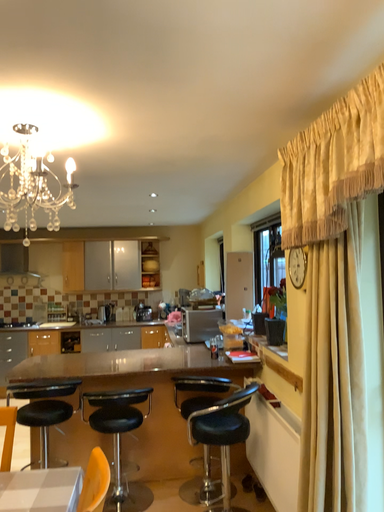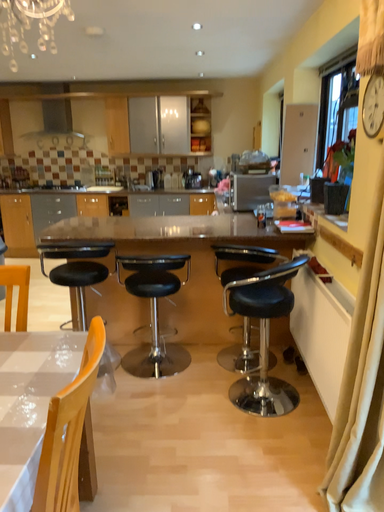
Question: Which way did the camera rotate in the video?

Choices:
 (A) rotated downward
 (B) rotated upward

Answer: (A)